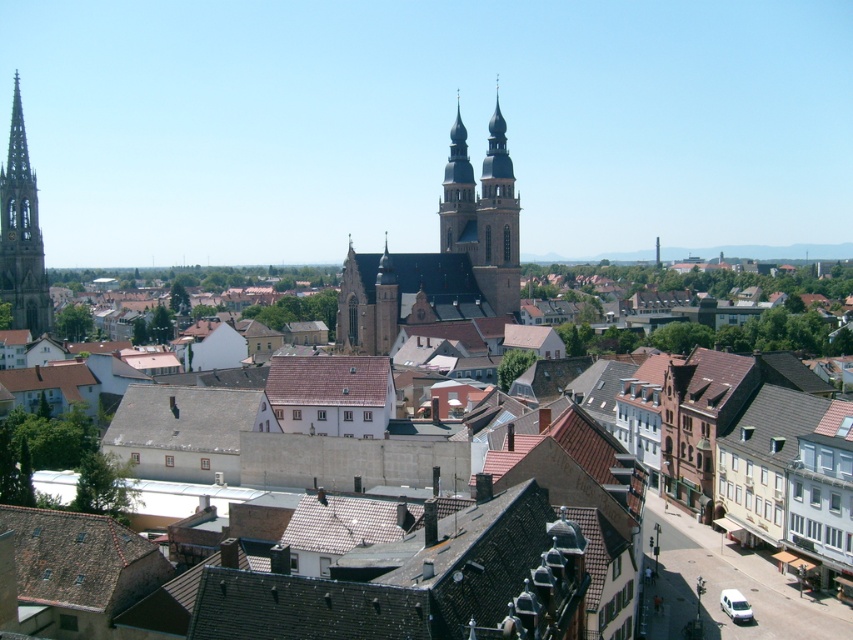
Question: Does brown tile roof at lower left have a lesser width compared to smooth stone church towers at center?

Choices:
 (A) no
 (B) yes

Answer: (B)

Question: Considering the real-world distances, which object is farthest from the smooth gray stone tower at left?

Choices:
 (A) brown tile roof at center
 (B) smooth stone church towers at center
 (C) brown stone church at center

Answer: (A)

Question: Considering the real-world distances, which object is closest to the gray slate roof at center?

Choices:
 (A) brown stone church at center
 (B) smooth gray stone tower at left
 (C) smooth stone church towers at center

Answer: (A)

Question: Which is nearer to the brown tile roof at lower left?

Choices:
 (A) brown tile roof at center
 (B) smooth gray stone tower at left

Answer: (A)

Question: Is brown tile roof at lower left smaller than gray slate roof at center?

Choices:
 (A) no
 (B) yes

Answer: (B)

Question: Is brown stone church at center above smooth gray stone tower at left?

Choices:
 (A) no
 (B) yes

Answer: (A)